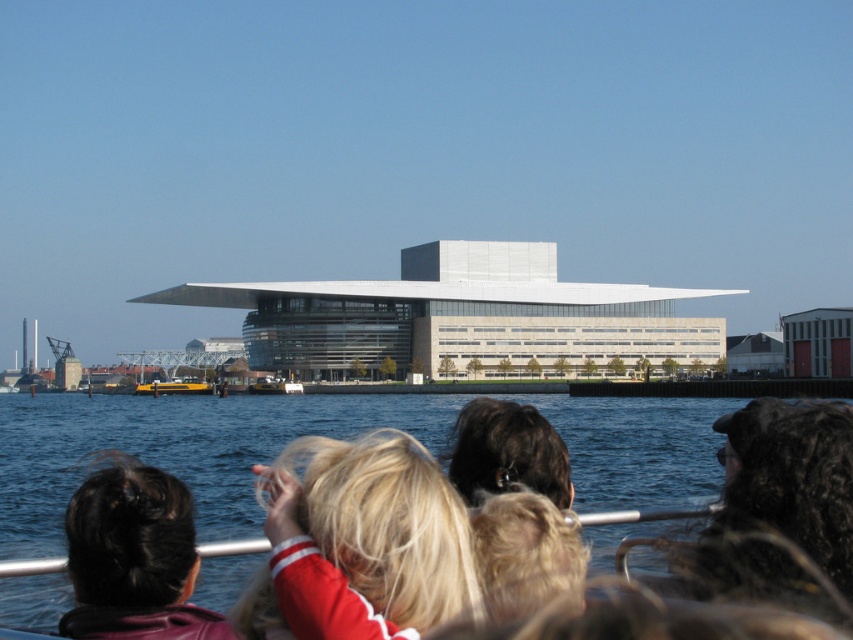
Which is more to the right, blue water at lower left or dark curly hair at upper right?

dark curly hair at upper right

Between point (583, 534) and point (807, 608), which one is positioned in front?

Positioned in front is point (807, 608).

Which is in front, point (223, 404) or point (775, 589)?

Point (775, 589) is more forward.

Locate an element on the screen. blue water at lower left is located at coordinates (178, 449).

Is point (85, 595) positioned after point (532, 444)?

No, it is not.

The image size is (853, 640). What are the coordinates of `dark brown hair at lower left` in the screenshot? It's located at (134, 556).

You are a GUI agent. You are given a task and a screenshot of the screen. Output one action in this format:
    pyautogui.click(x=<x>, y=<y>)
    Task: Click on the dark brown hair at lower left
    Image resolution: width=853 pixels, height=640 pixels.
    Given the screenshot: What is the action you would take?
    pyautogui.click(x=134, y=556)

Does dark brown hair at lower left lie in front of yellow rubber boat at lower left?

That is True.

Which is in front, point (178, 525) or point (190, 384)?

Positioned in front is point (178, 525).

Identify the location of dark brown hair at lower left. Image resolution: width=853 pixels, height=640 pixels. pos(134,556).